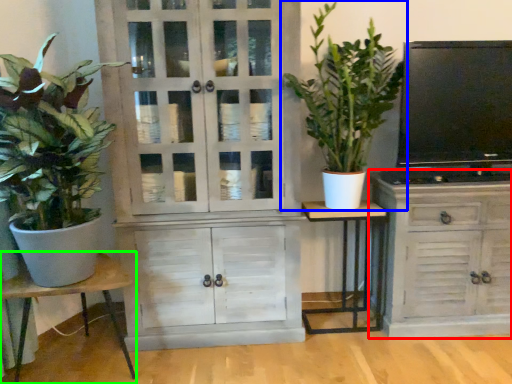
Question: Which object is positioned closest to cabinetry (highlighted by a red box)? Select from houseplant (highlighted by a blue box) and table (highlighted by a green box).

Choices:
 (A) houseplant
 (B) table

Answer: (A)